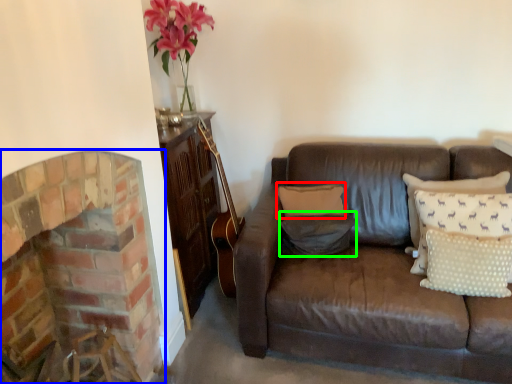
Question: Which object is positioned closest to pillow (highlighted by a red box)? Select from fireplace (highlighted by a blue box) and pillow (highlighted by a green box).

Choices:
 (A) fireplace
 (B) pillow

Answer: (B)